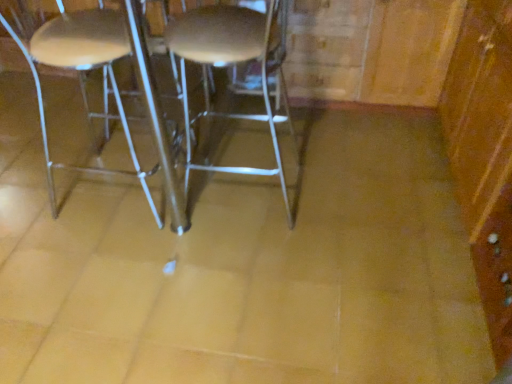
You are a GUI agent. You are given a task and a screenshot of the screen. Output one action in this format:
    pyautogui.click(x=<x>, y=<y>)
    Task: Click on the vacant space in front of metallic silver stool at center
    
    Given the screenshot: What is the action you would take?
    pyautogui.click(x=250, y=265)